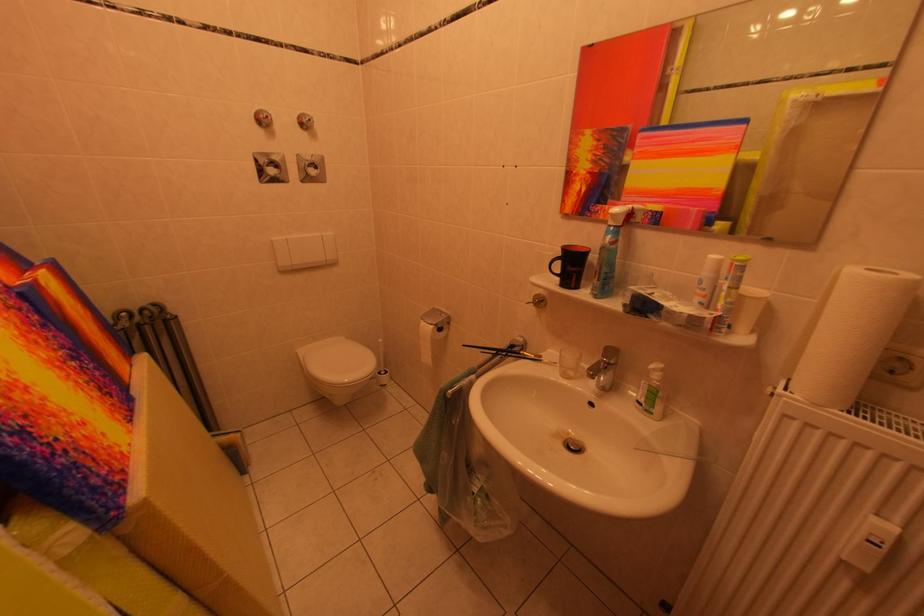
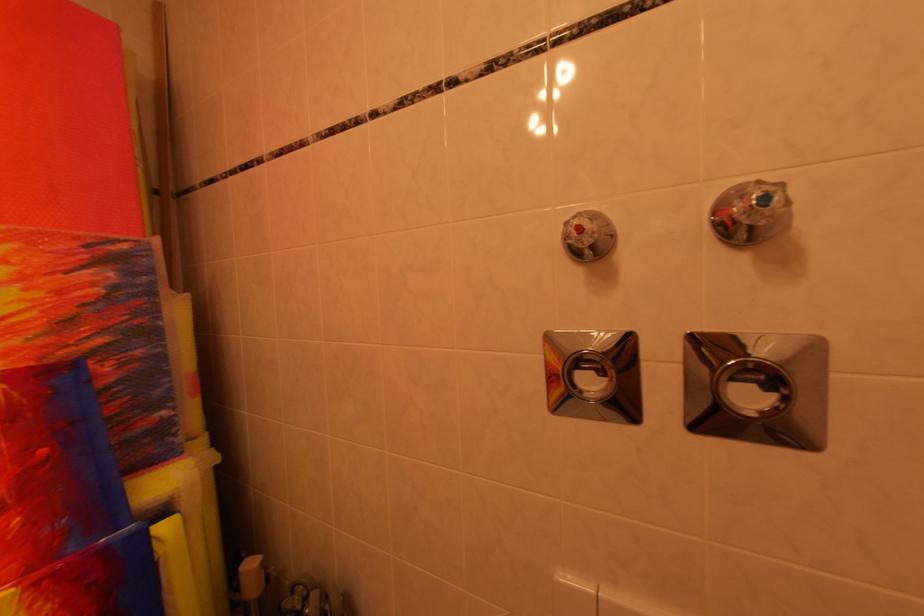
In the second image, find the point that corresponds to the point at 320,123 in the first image.

(773, 201)